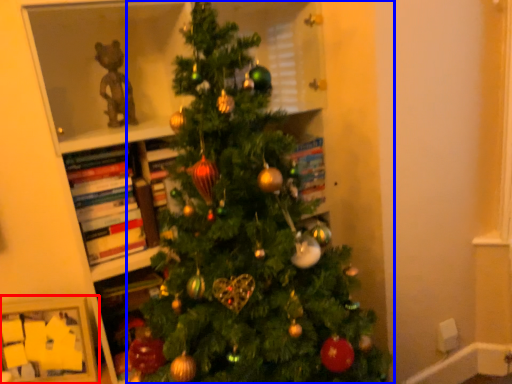
Question: Which of the following is the farthest to the observer, picture frame (highlighted by a red box) or christmas tree (highlighted by a blue box)?

Choices:
 (A) picture frame
 (B) christmas tree

Answer: (A)